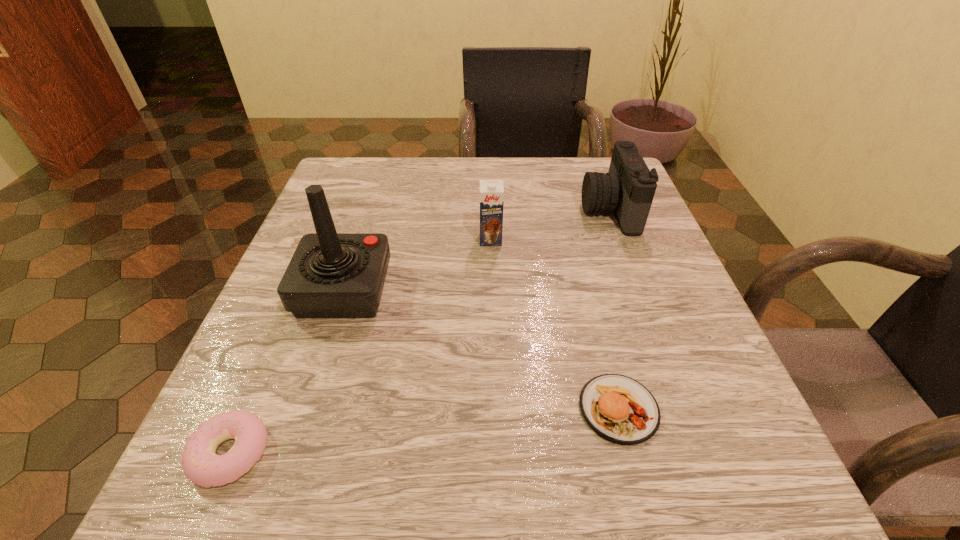
This screenshot has height=540, width=960. In order to click on unoccupied position between the camera and the third nearest object in this screenshot , I will do `click(476, 249)`.

I want to click on free spot between the joystick and the third object from right to left, so click(x=418, y=265).

You are a GUI agent. You are given a task and a screenshot of the screen. Output one action in this format:
    pyautogui.click(x=<x>, y=<y>)
    Task: Click on the free point between the doughnut and the fourth tallest object
    This screenshot has height=540, width=960.
    Given the screenshot: What is the action you would take?
    pyautogui.click(x=424, y=431)

This screenshot has height=540, width=960. In order to click on free space between the tallest object and the shortest object in this screenshot , I will do `click(287, 372)`.

Locate an element on the screen. The image size is (960, 540). empty space that is in between the tallest object and the shortest object is located at coordinates (287, 372).

Identify the location of free space that is in between the tallest object and the second shortest object. The height and width of the screenshot is (540, 960). (481, 349).

Find the location of a particular element. free space between the fourth tallest object and the third nearest object is located at coordinates (481, 349).

At what (x,y) coordinates should I click in order to perform the action: click on vacant point located between the joystick and the camera. Please return your answer as a coordinate pair (x, y). This screenshot has height=540, width=960. Looking at the image, I should click on (476, 249).

Where is `free space between the joystick and the camera`? This screenshot has height=540, width=960. free space between the joystick and the camera is located at coordinates (476, 249).

At what (x,y) coordinates should I click in order to perform the action: click on object that is the closest one to the patty. Please return your answer as a coordinate pair (x, y). Looking at the image, I should click on (491, 191).